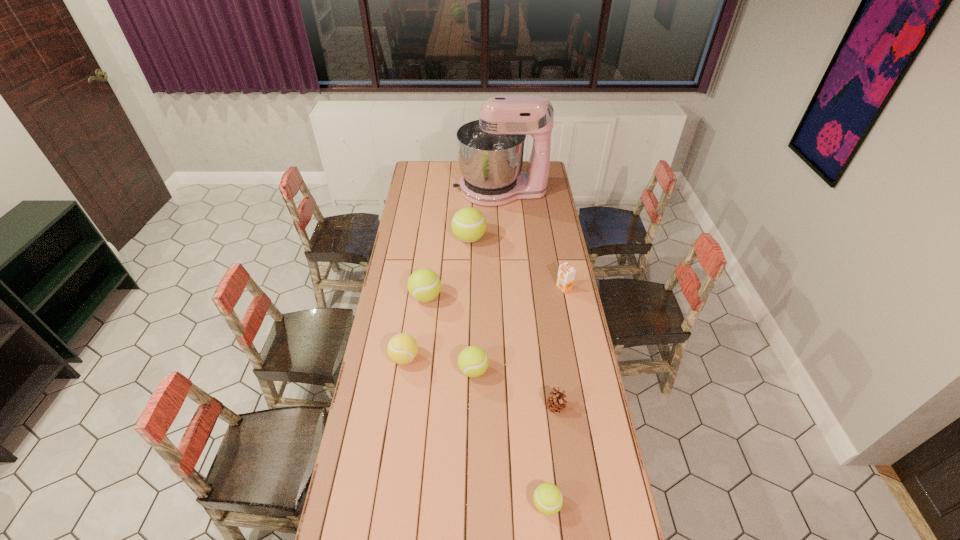
Locate an element on the screen. The image size is (960, 540). tennis ball that is the third closest to the pinecone is located at coordinates (402, 348).

Locate which tennis ball ranks second in proximity to the second smallest green tennis ball. Please provide its 2D coordinates. Your answer should be formatted as a tuple, i.e. [(x, y)], where the tuple contains the x and y coordinates of a point satisfying the conditions above.

[(424, 285)]

At what (x,y) coordinates should I click in order to perform the action: click on the second closest green tennis ball relative to the third biggest green tennis ball. Please return your answer as a coordinate pair (x, y). Looking at the image, I should click on (548, 499).

Select which green tennis ball appears as the second closest to the orange orange juice. Please provide its 2D coordinates. Your answer should be formatted as a tuple, i.e. [(x, y)], where the tuple contains the x and y coordinates of a point satisfying the conditions above.

[(473, 361)]

Where is `blank space that satisfies the following two spatial constraints: 1. on the front side of the nearest object; 2. on the left side of the fourth shortest tennis ball`? blank space that satisfies the following two spatial constraints: 1. on the front side of the nearest object; 2. on the left side of the fourth shortest tennis ball is located at coordinates (400, 504).

At what (x,y) coordinates should I click in order to perform the action: click on free spot that satisfies the following two spatial constraints: 1. on the front-facing side of the farthest object; 2. on the back side of the shortest tennis ball. Please return your answer as a coordinate pair (x, y). Looking at the image, I should click on (518, 504).

Find the location of a particular element. vacant space that satisfies the following two spatial constraints: 1. on the front-facing side of the nearest green tennis ball; 2. on the right side of the mixer is located at coordinates (518, 504).

Find the location of a particular element. This screenshot has width=960, height=540. free spot that satisfies the following two spatial constraints: 1. on the front-facing side of the tallest object; 2. on the back side of the orange juice is located at coordinates (506, 288).